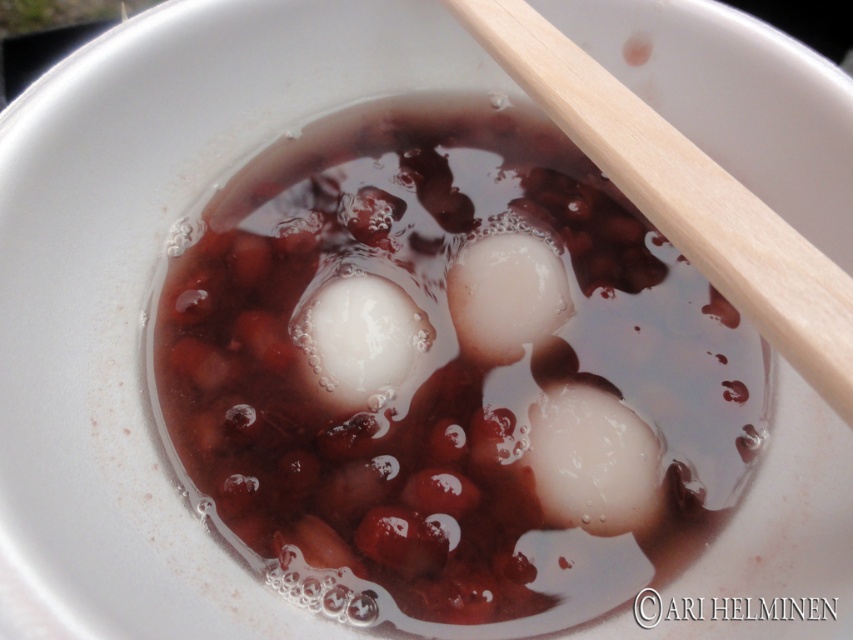
Question: In this image, where is white glossy balls at center located relative to wooden at upper right?

Choices:
 (A) right
 (B) left

Answer: (B)

Question: From the image, what is the correct spatial relationship of white glossy balls at center in relation to wooden at upper right?

Choices:
 (A) left
 (B) right

Answer: (A)

Question: Does white glossy balls at center have a greater width compared to wooden at upper right?

Choices:
 (A) no
 (B) yes

Answer: (B)

Question: Which point is farther to the camera?

Choices:
 (A) wooden at upper right
 (B) white glossy balls at center

Answer: (B)

Question: Which point is farther to the camera?

Choices:
 (A) (706, 189)
 (B) (496, 618)

Answer: (B)